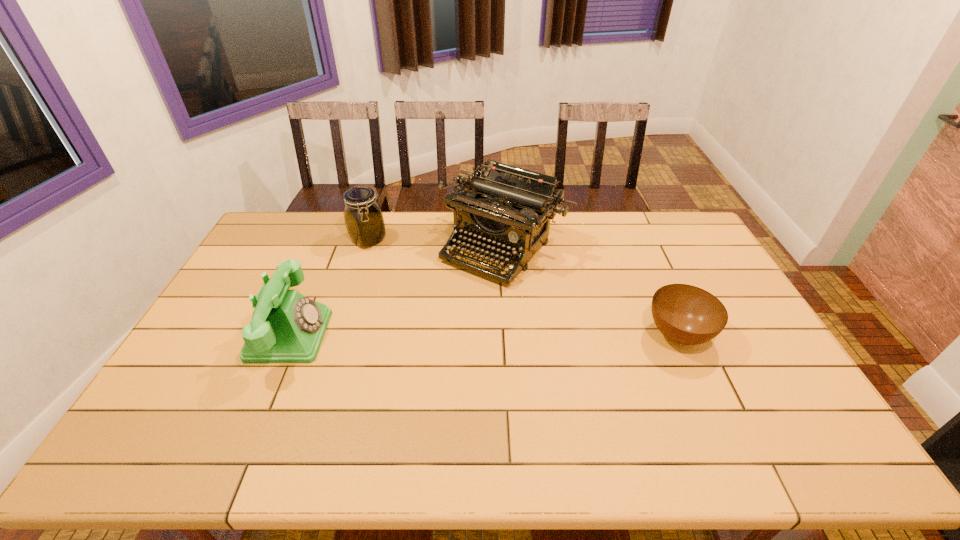
What are the coordinates of `vacant region between the jar and the bowl` in the screenshot? It's located at (523, 287).

You are a GUI agent. You are given a task and a screenshot of the screen. Output one action in this format:
    pyautogui.click(x=<x>, y=<y>)
    Task: Click on the unoccupied position between the telephone and the rightmost object
    The height and width of the screenshot is (540, 960).
    Given the screenshot: What is the action you would take?
    pyautogui.click(x=484, y=335)

I want to click on object that can be found as the third closest to the jar, so click(686, 314).

Select which object is the closest to the jar. Please provide its 2D coordinates. Your answer should be formatted as a tuple, i.e. [(x, y)], where the tuple contains the x and y coordinates of a point satisfying the conditions above.

[(509, 210)]

The height and width of the screenshot is (540, 960). In order to click on vacant region that satisfies the following two spatial constraints: 1. on the front side of the rightmost object; 2. on the left side of the second object from right to left in this screenshot , I will do `click(511, 334)`.

Where is `free location that satisfies the following two spatial constraints: 1. on the front side of the bowl; 2. on the left side of the jar`? This screenshot has height=540, width=960. free location that satisfies the following two spatial constraints: 1. on the front side of the bowl; 2. on the left side of the jar is located at coordinates (338, 334).

The height and width of the screenshot is (540, 960). In order to click on vacant space that satisfies the following two spatial constraints: 1. on the front side of the jar; 2. on the left side of the shortest object in this screenshot , I will do `click(338, 334)`.